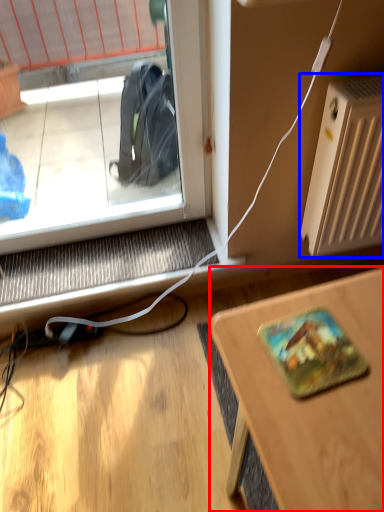
Question: Which point is further to the camera, desk (highlighted by a red box) or radiator (highlighted by a blue box)?

Choices:
 (A) desk
 (B) radiator

Answer: (B)